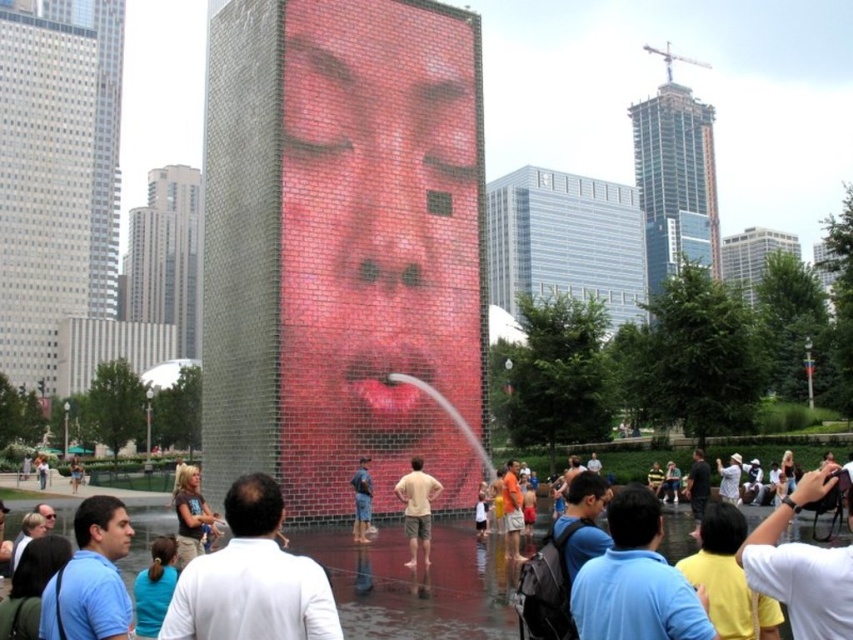
Is matte black shirt at center below light beige cotton shirt at center?

No, matte black shirt at center is not below light beige cotton shirt at center.

The width and height of the screenshot is (853, 640). What do you see at coordinates (252, 579) in the screenshot?
I see `matte black shirt at center` at bounding box center [252, 579].

At what (x,y) coordinates should I click in order to perform the action: click on matte black shirt at center. Please return your answer as a coordinate pair (x, y). The image size is (853, 640). Looking at the image, I should click on (252, 579).

Does brown leather jacket at lower left appear over denim shorts at center?

Incorrect, brown leather jacket at lower left is not positioned above denim shorts at center.

Can you confirm if brown leather jacket at lower left is bigger than denim shorts at center?

Correct, brown leather jacket at lower left is larger in size than denim shorts at center.

The width and height of the screenshot is (853, 640). Find the location of `brown leather jacket at lower left`. brown leather jacket at lower left is located at coordinates (190, 518).

Where is `brown leather jacket at lower left`? brown leather jacket at lower left is located at coordinates (190, 518).

Is point (408, 502) positioned after point (103, 541)?

That is True.

Who is positioned more to the left, light beige cotton shirt at center or matte skin face at lower left?

matte skin face at lower left

Which is behind, point (416, 508) or point (120, 532)?

Point (416, 508)

I want to click on light beige cotton shirt at center, so click(x=416, y=508).